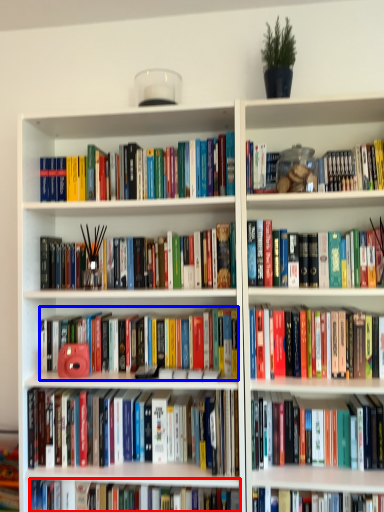
Question: Which object appears farthest to the camera in this image, book (highlighted by a red box) or book (highlighted by a blue box)?

Choices:
 (A) book
 (B) book

Answer: (B)